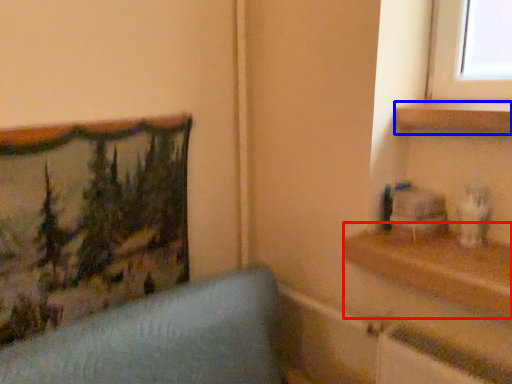
Question: Which object is further to the camera taking this photo, shelf (highlighted by a red box) or shelf (highlighted by a blue box)?

Choices:
 (A) shelf
 (B) shelf

Answer: (B)